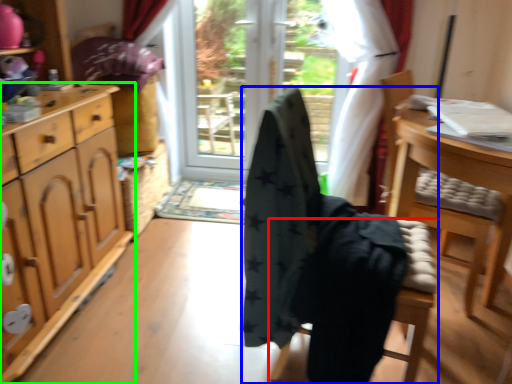
Question: Estimate the real-world distances between objects in this image. Which object is farther from chair (highlighted by a red box), chair (highlighted by a blue box) or cabinetry (highlighted by a green box)?

Choices:
 (A) chair
 (B) cabinetry

Answer: (B)